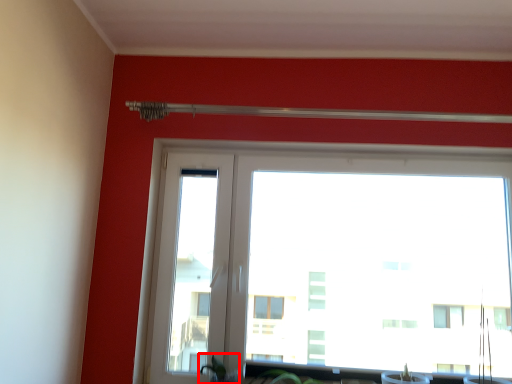
Question: Considering the relative positions of plant (annotated by the red box) and window in the image provided, where is plant (annotated by the red box) located with respect to the staircase?

Choices:
 (A) right
 (B) left

Answer: (B)